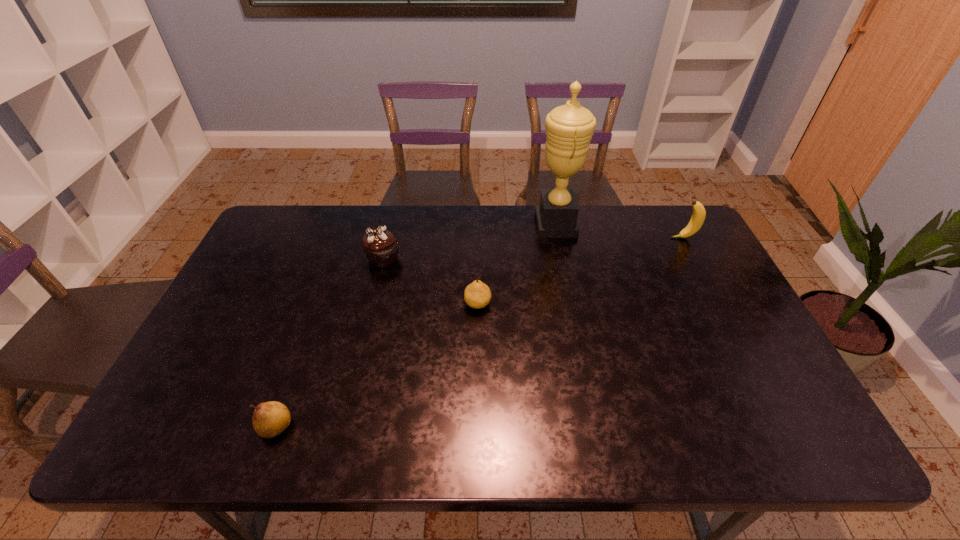
Image resolution: width=960 pixels, height=540 pixels. Identify the location of vacant region at the near left corner of the desktop. (182, 427).

At what (x,y) coordinates should I click in order to perform the action: click on vacant position at the far right corner of the desktop. Please return your answer as a coordinate pair (x, y). This screenshot has height=540, width=960. Looking at the image, I should click on (669, 236).

This screenshot has height=540, width=960. I want to click on free space at the near right corner of the desktop, so click(x=745, y=443).

You are a GUI agent. You are given a task and a screenshot of the screen. Output one action in this format:
    pyautogui.click(x=<x>, y=<y>)
    Task: Click on the vacant point located between the cupcake and the third object from right to left
    The width and height of the screenshot is (960, 540).
    Given the screenshot: What is the action you would take?
    pyautogui.click(x=430, y=281)

Locate an element on the screen. vacant area between the leftmost object and the banana is located at coordinates (480, 333).

I want to click on free spot between the cupcake and the second tallest object, so click(533, 248).

You are a GUI agent. You are given a task and a screenshot of the screen. Output one action in this format:
    pyautogui.click(x=<x>, y=<y>)
    Task: Click on the free point between the farther pear and the rightmost object
    This screenshot has height=540, width=960.
    Given the screenshot: What is the action you would take?
    pyautogui.click(x=581, y=271)

Where is `vacant region between the trophy cup and the rightmost object`? vacant region between the trophy cup and the rightmost object is located at coordinates (619, 231).

The width and height of the screenshot is (960, 540). I want to click on vacant region between the tallest object and the second tallest object, so click(619, 231).

The height and width of the screenshot is (540, 960). Identify the location of free spot between the second tallest object and the third object from right to left. (581, 271).